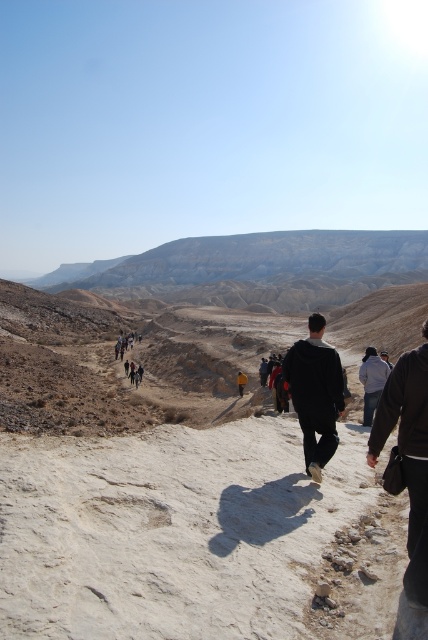
Between dusty sand desert at center and black matte jacket at center, which one appears on the right side from the viewer's perspective?

black matte jacket at center is more to the right.

Is point (350, 316) positioned behind point (312, 412)?

Yes, it is behind point (312, 412).

Identify the location of dusty sand desert at center. (184, 477).

Can you confirm if dusty sand desert at center is smaller than desert sandstone mountain at upper center?

Indeed, dusty sand desert at center has a smaller size compared to desert sandstone mountain at upper center.

Does dusty sand desert at center lie behind desert sandstone mountain at upper center?

No, it is not.

Between point (240, 403) and point (247, 304), which one is positioned in front?

Positioned in front is point (240, 403).

Locate an element on the screen. Image resolution: width=428 pixels, height=640 pixels. dusty sand desert at center is located at coordinates (184, 477).

Between point (287, 237) and point (303, 364), which one is positioned in front?

Point (303, 364) is in front.

Between point (237, 285) and point (312, 353), which one is positioned behind?

Point (237, 285)

What are the coordinates of `desert sandstone mountain at upper center` in the screenshot? It's located at (256, 269).